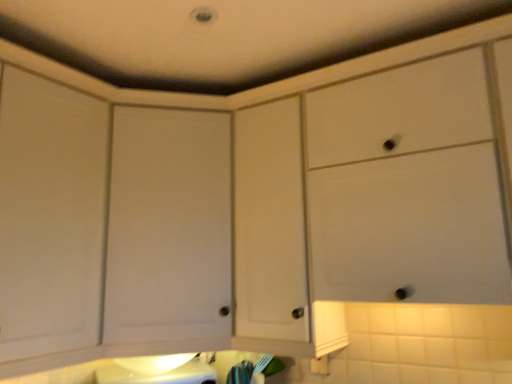
Question: Do you think white matte cabinet at upper center, the second cabinetry from the left, is within white matte cabinet door at center, which is the 1th cabinetry from left to right, or outside of it?

Choices:
 (A) inside
 (B) outside

Answer: (B)

Question: Is point (480, 180) positioned closer to the camera than point (159, 127)?

Choices:
 (A) closer
 (B) farther

Answer: (A)

Question: From the image's perspective, is white matte cabinet at upper center, which is counted as the first cabinetry, starting from the right, positioned above or below white matte cabinet door at center, the 2th cabinetry viewed from the right?

Choices:
 (A) above
 (B) below

Answer: (A)

Question: Is white matte cabinet door at center, the 2th cabinetry viewed from the right, wider or thinner than white matte cabinet at upper center, the second cabinetry from the left?

Choices:
 (A) wide
 (B) thin

Answer: (A)

Question: In terms of height, does white matte cabinet door at center, which is the 1th cabinetry from left to right, look taller or shorter compared to white matte cabinet at upper center, which is counted as the first cabinetry, starting from the right?

Choices:
 (A) short
 (B) tall

Answer: (B)

Question: Considering the relative positions of white matte cabinet door at center, which is the 1th cabinetry from left to right, and white matte cabinet at upper center, which is counted as the first cabinetry, starting from the right, in the image provided, is white matte cabinet door at center, which is the 1th cabinetry from left to right, to the left or to the right of white matte cabinet at upper center, which is counted as the first cabinetry, starting from the right,?

Choices:
 (A) right
 (B) left

Answer: (B)

Question: Based on their sizes in the image, would you say white matte cabinet door at center, the 2th cabinetry viewed from the right, is bigger or smaller than white matte cabinet at upper center, the second cabinetry from the left?

Choices:
 (A) small
 (B) big

Answer: (A)